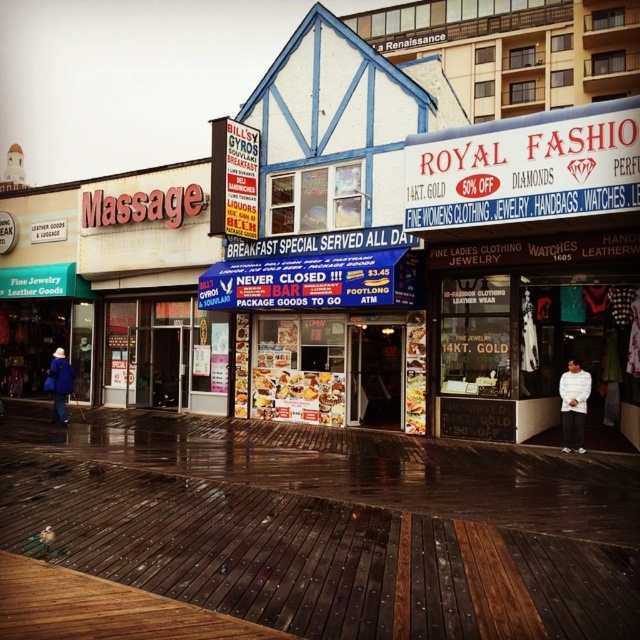
Question: Can you confirm if white fabric shirt at lower right is smaller than blue woolen coat at lower left?

Choices:
 (A) no
 (B) yes

Answer: (B)

Question: Estimate the real-world distances between objects in this image. Which object is closer to the golden crispy fries at center?

Choices:
 (A) blue woolen coat at lower left
 (B) white fabric shirt at lower right

Answer: (A)

Question: Which point is farther from the camera taking this photo?

Choices:
 (A) (282, 413)
 (B) (568, 381)

Answer: (A)

Question: Which object appears farthest from the camera in this image?

Choices:
 (A) blue woolen coat at lower left
 (B) golden crispy fries at center

Answer: (A)

Question: Does white fabric shirt at lower right have a smaller size compared to blue woolen coat at lower left?

Choices:
 (A) yes
 (B) no

Answer: (A)

Question: Can you confirm if golden crispy fries at center is smaller than blue woolen coat at lower left?

Choices:
 (A) yes
 (B) no

Answer: (A)